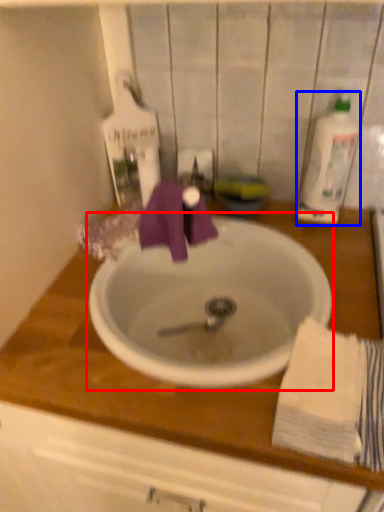
Question: Among these objects, which one is nearest to the camera, sink (highlighted by a red box) or cleaning product (highlighted by a blue box)?

Choices:
 (A) sink
 (B) cleaning product

Answer: (A)